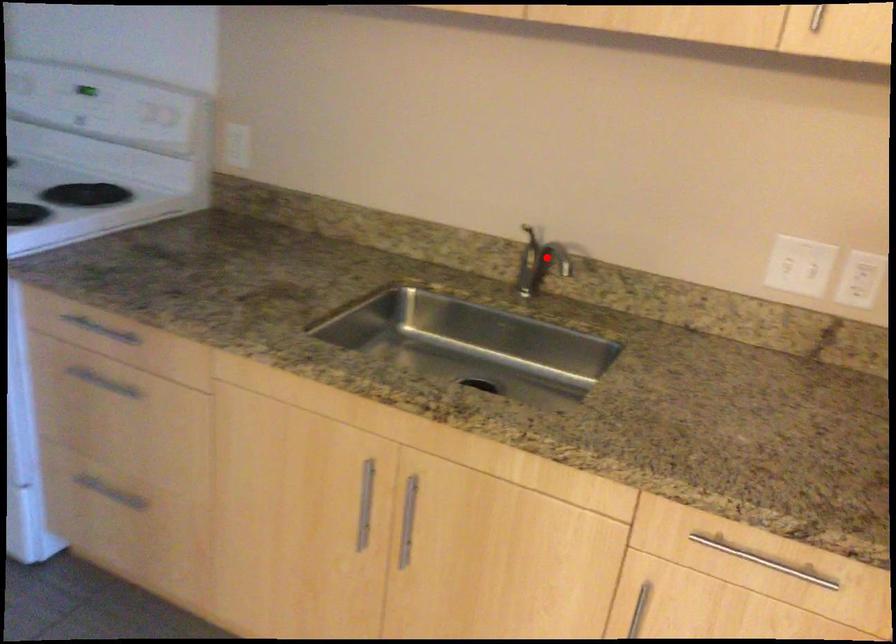
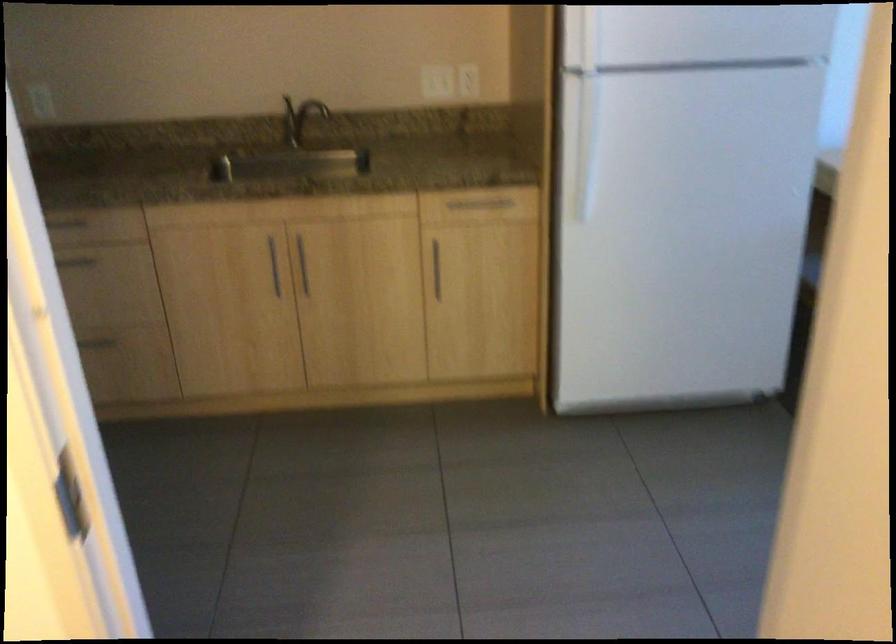
Find the pixel in the second image that matches the highlighted location in the first image.

(299, 118)